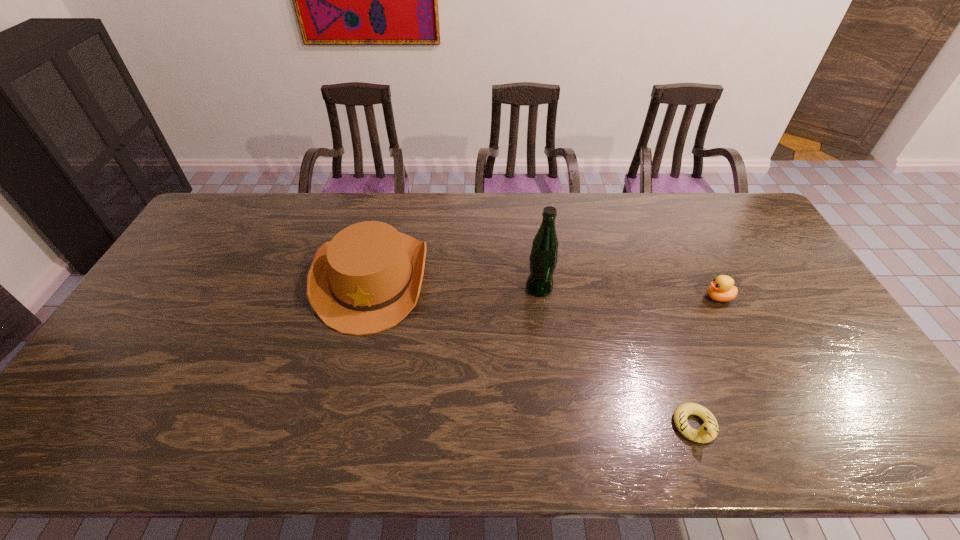
At what (x,y) coordinates should I click in order to perform the action: click on the second object from left to right. Please return your answer as a coordinate pair (x, y). Looking at the image, I should click on (543, 258).

Identify the location of beer bottle. click(543, 258).

At what (x,y) coordinates should I click in order to perform the action: click on the leftmost object. Please return your answer as a coordinate pair (x, y). This screenshot has width=960, height=540. Looking at the image, I should click on (367, 279).

At what (x,y) coordinates should I click in order to perform the action: click on cowboy hat. Please return your answer as a coordinate pair (x, y). The image size is (960, 540). Looking at the image, I should click on (367, 279).

At what (x,y) coordinates should I click in order to perform the action: click on the right duckling. Please return your answer as a coordinate pair (x, y). Image resolution: width=960 pixels, height=540 pixels. Looking at the image, I should click on (721, 289).

Image resolution: width=960 pixels, height=540 pixels. Find the location of `the taller duckling`. the taller duckling is located at coordinates 721,289.

Where is `the left duckling`? This screenshot has height=540, width=960. the left duckling is located at coordinates (708, 431).

Locate an element on the screen. Image resolution: width=960 pixels, height=540 pixels. the nearest object is located at coordinates (708, 431).

Image resolution: width=960 pixels, height=540 pixels. I want to click on vacant area situated on the right of the second object from left to right, so click(x=684, y=288).

The image size is (960, 540). What are the coordinates of `vacant area situated 0.260m on the front-facing side of the third shortest object` in the screenshot? It's located at (338, 425).